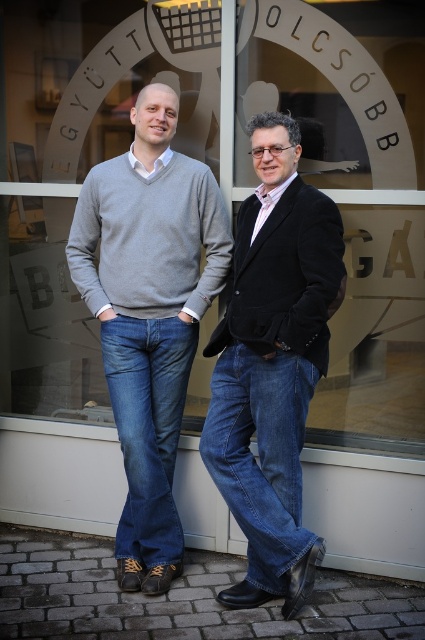
You are a fashion designer observing two people in the scene. You need to determine which clothing item takes up more horizontal space between the denim jeans at center and the black velvet blazer at center. Which one is wider?

The denim jeans at center is wider than the black velvet blazer at center according to the description provided.

You are standing in front of the glass storefront with the EGYUJT OLCSOBB logo. There is a point marked at coordinates (272, 364). What object is located at that point?

The point at coordinates (272, 364) indicates denim jeans at center.